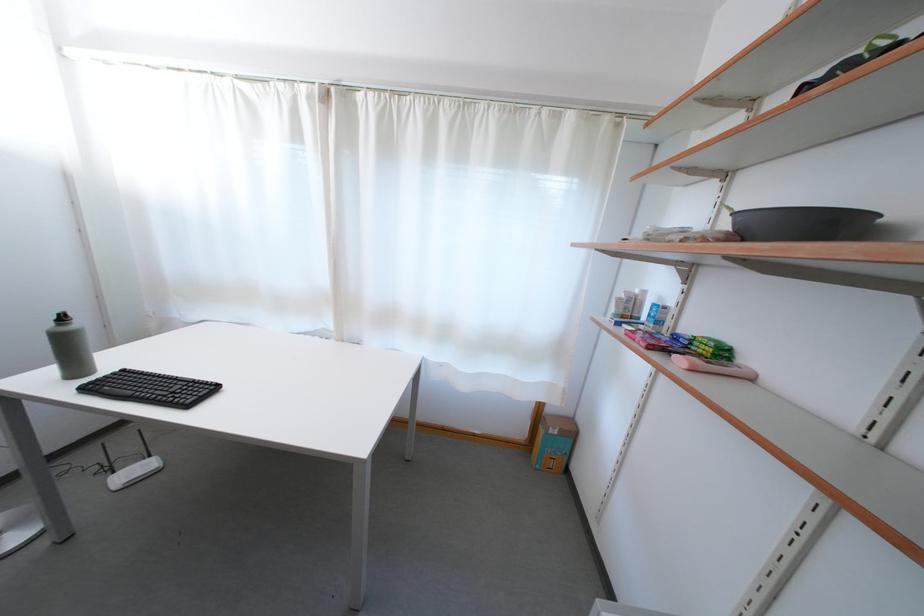
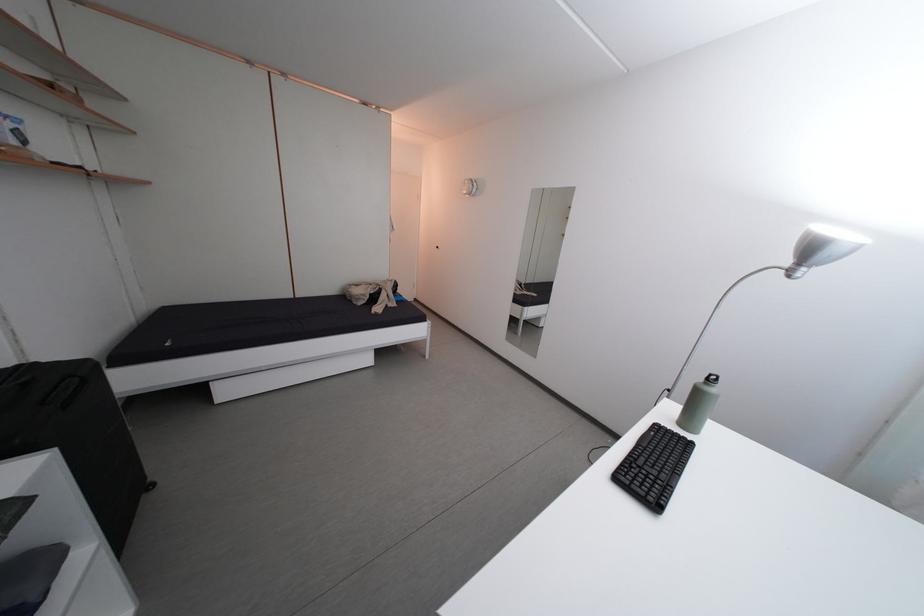
The point at (198, 411) is marked in the first image. Where is the corresponding point in the second image?

(626, 485)